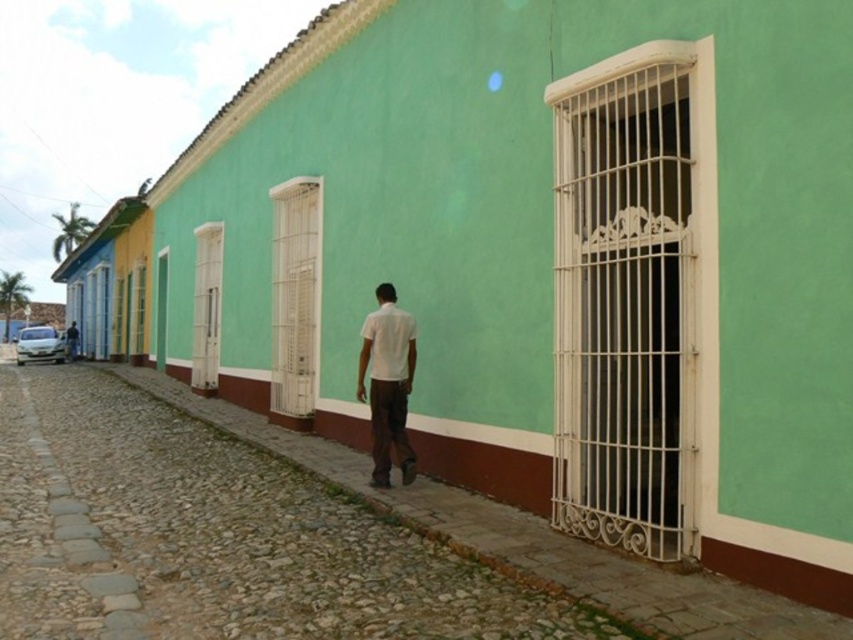
Question: Is white matte shirt at center positioned in front of white glossy car at left?

Choices:
 (A) no
 (B) yes

Answer: (B)

Question: Which point is closer to the camera taking this photo?

Choices:
 (A) (401, 397)
 (B) (39, 336)

Answer: (A)

Question: Is white matte shirt at center bigger than white glossy car at left?

Choices:
 (A) no
 (B) yes

Answer: (A)

Question: Which of the following is the closest to the observer?

Choices:
 (A) (370, 321)
 (B) (51, 349)

Answer: (A)

Question: Considering the relative positions of white matte shirt at center and white glossy car at left in the image provided, where is white matte shirt at center located with respect to white glossy car at left?

Choices:
 (A) below
 (B) above

Answer: (B)